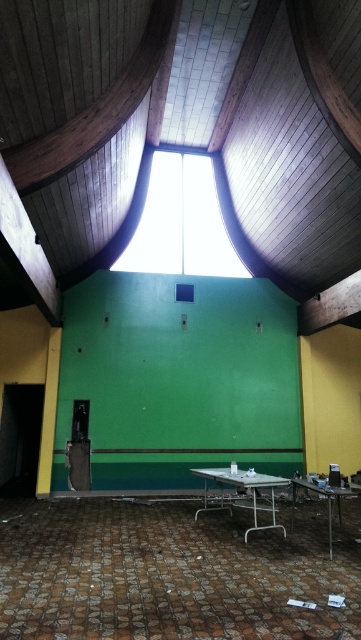
This screenshot has height=640, width=361. Identify the location of transparent glass window at center. (180, 221).

Between point (148, 228) and point (264, 528), which one is positioned behind?

The point (148, 228) is behind.

The image size is (361, 640). Identify the location of transparent glass window at center. (180, 221).

Who is positioned more to the left, transparent glass window at center or metallic silver table at lower right?

Positioned to the left is transparent glass window at center.

Who is lower down, transparent glass window at center or metallic silver table at lower right?

Positioned lower is metallic silver table at lower right.

Is point (188, 193) less distant than point (306, 484)?

No.

Where is `transparent glass window at center`? The width and height of the screenshot is (361, 640). transparent glass window at center is located at coordinates (180, 221).

At what (x,y) coordinates should I click in order to perform the action: click on metallic silver table at center. Please return your answer as a coordinate pair (x, y). Image resolution: width=361 pixels, height=640 pixels. Looking at the image, I should click on (244, 490).

Between point (254, 508) and point (329, 528), which one is positioned in front?

Point (329, 528) is more forward.

I want to click on metallic silver table at center, so click(244, 490).